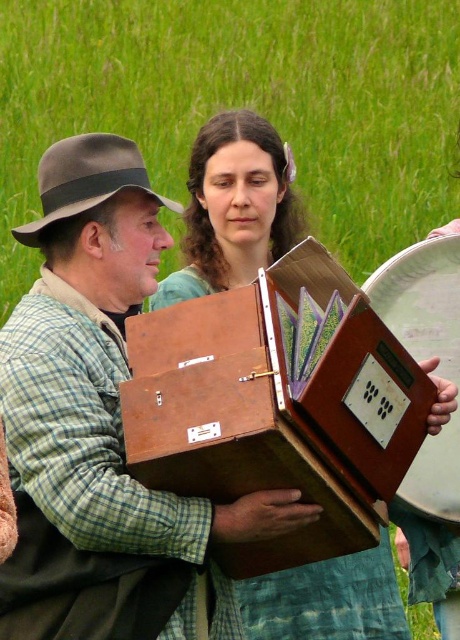
Question: Which object is farther from the camera taking this photo?

Choices:
 (A) wooden box at center
 (B) wooden accordion at center

Answer: (A)

Question: Does wooden accordion at center come in front of wooden box at center?

Choices:
 (A) no
 (B) yes

Answer: (B)

Question: Which object appears closest to the camera in this image?

Choices:
 (A) wooden box at center
 (B) wooden accordion at center

Answer: (B)

Question: Is wooden accordion at center further to camera compared to wooden box at center?

Choices:
 (A) no
 (B) yes

Answer: (A)

Question: Is wooden accordion at center above wooden box at center?

Choices:
 (A) no
 (B) yes

Answer: (A)

Question: Which object is farther from the camera taking this photo?

Choices:
 (A) wooden box at center
 (B) wooden accordion at center

Answer: (A)